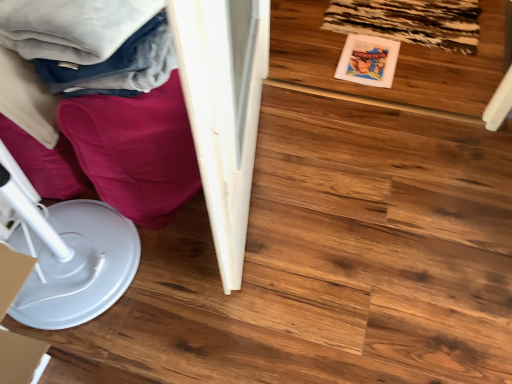
Question: Can you confirm if white glossy wardrobe at left is bigger than white plastic paper plate at lower left?

Choices:
 (A) yes
 (B) no

Answer: (A)

Question: Could you tell me if white glossy wardrobe at left is facing white plastic paper plate at lower left?

Choices:
 (A) no
 (B) yes

Answer: (A)

Question: From the image's perspective, would you say white glossy wardrobe at left is shown under white plastic paper plate at lower left?

Choices:
 (A) no
 (B) yes

Answer: (A)

Question: Is the depth of white glossy wardrobe at left greater than that of white plastic paper plate at lower left?

Choices:
 (A) yes
 (B) no

Answer: (A)

Question: Are white glossy wardrobe at left and white plastic paper plate at lower left far apart?

Choices:
 (A) no
 (B) yes

Answer: (A)

Question: Is wooden floor at center taller or shorter than soft cotton blanket at upper left?

Choices:
 (A) short
 (B) tall

Answer: (A)

Question: Choose the correct answer: Is wooden floor at center inside soft cotton blanket at upper left or outside it?

Choices:
 (A) inside
 (B) outside

Answer: (B)

Question: From a real-world perspective, is wooden floor at center above or below soft cotton blanket at upper left?

Choices:
 (A) above
 (B) below

Answer: (B)

Question: From the image's perspective, is wooden floor at center above or below soft cotton blanket at upper left?

Choices:
 (A) above
 (B) below

Answer: (A)

Question: Based on their sizes in the image, would you say white glossy wardrobe at left is bigger or smaller than wooden floor at center?

Choices:
 (A) small
 (B) big

Answer: (B)

Question: Considering their positions, is white glossy wardrobe at left located in front of or behind wooden floor at center?

Choices:
 (A) front
 (B) behind

Answer: (A)

Question: From the image's perspective, is white glossy wardrobe at left located above or below wooden floor at center?

Choices:
 (A) above
 (B) below

Answer: (B)

Question: Would you say white glossy wardrobe at left is to the left or to the right of wooden floor at center in the picture?

Choices:
 (A) left
 (B) right

Answer: (A)

Question: Which is correct: soft cotton blanket at upper left is inside white plastic paper plate at lower left, or outside of it?

Choices:
 (A) outside
 (B) inside

Answer: (A)

Question: In terms of size, does soft cotton blanket at upper left appear bigger or smaller than white plastic paper plate at lower left?

Choices:
 (A) big
 (B) small

Answer: (B)